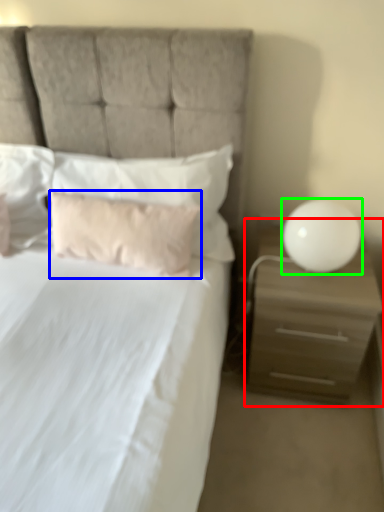
Question: Estimate the real-world distances between objects in this image. Which object is farther from nightstand (highlighted by a red box), pillow (highlighted by a blue box) or table lamp (highlighted by a green box)?

Choices:
 (A) pillow
 (B) table lamp

Answer: (A)